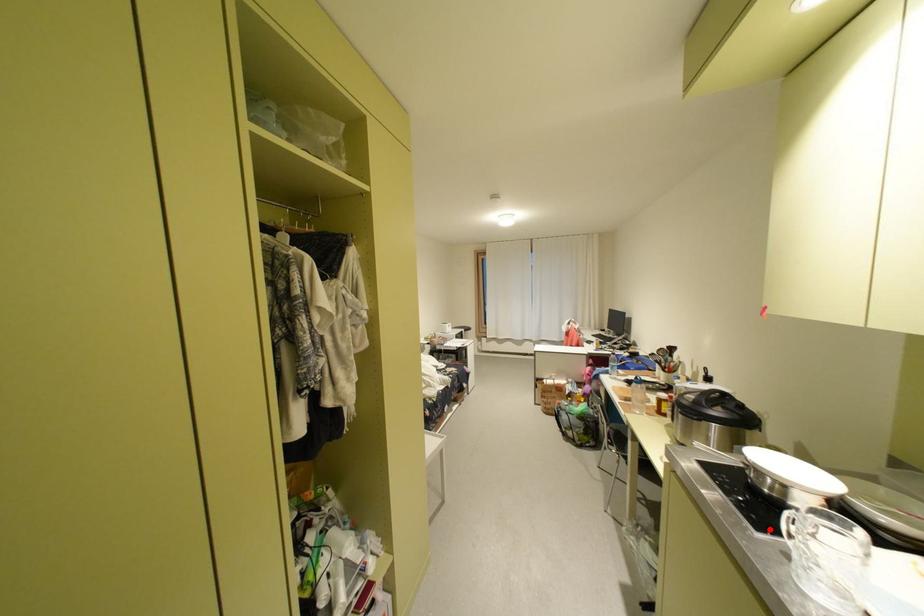
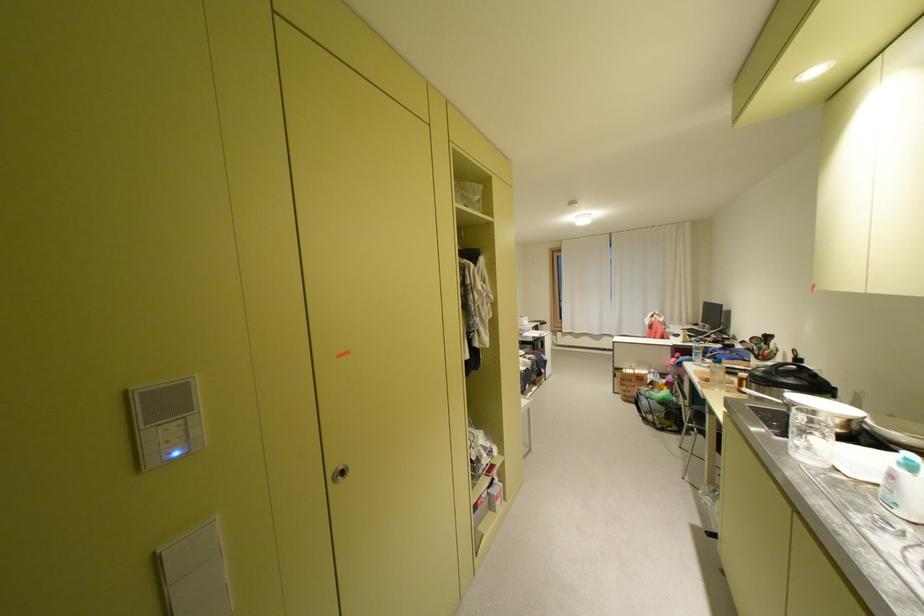
Where in the second image is the point corresponding to the highlighted location from the first image?

(789, 436)